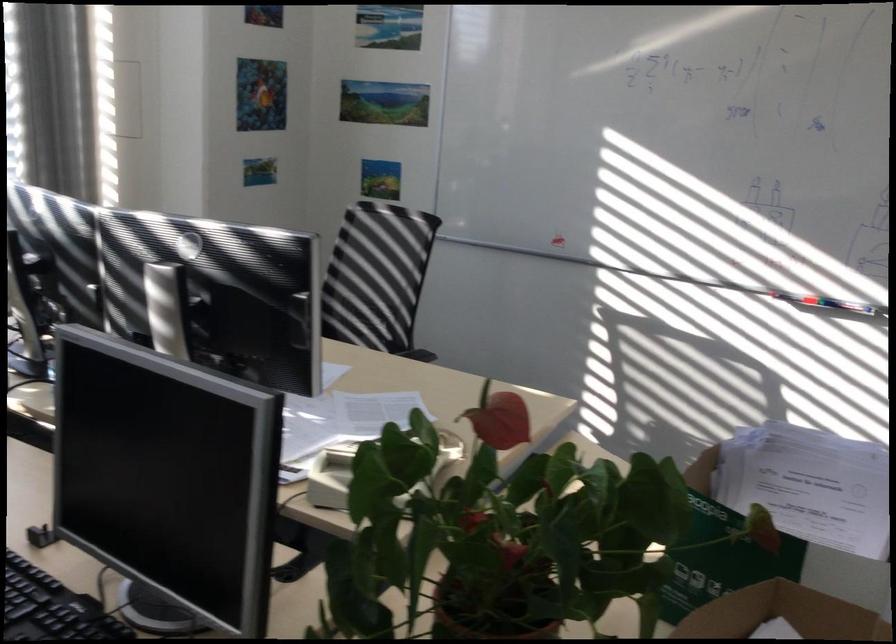
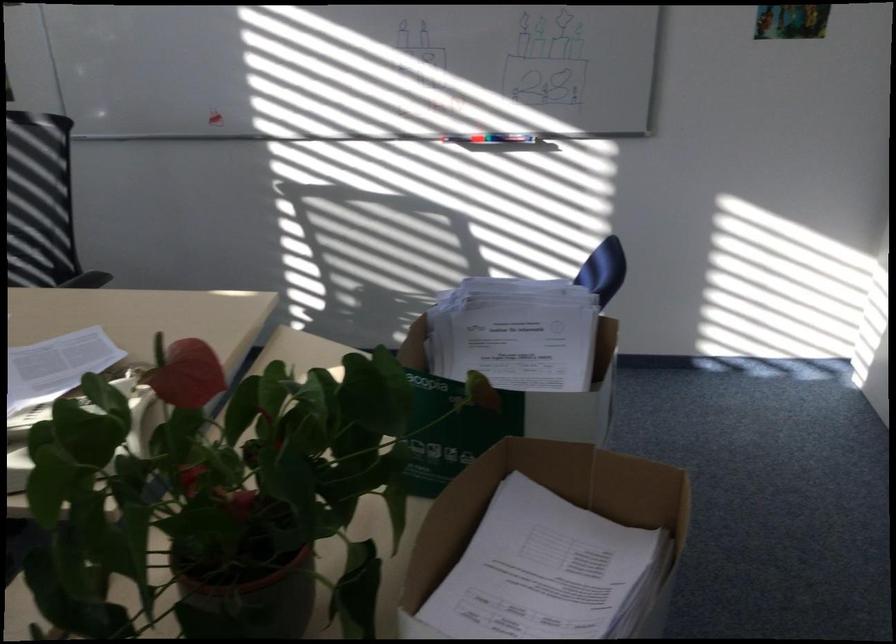
The point at (821, 298) is marked in the first image. Where is the corresponding point in the second image?

(488, 138)